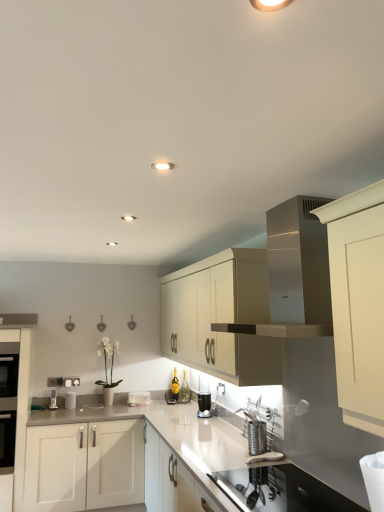
Question: From the image's perspective, is clear glass cup at center, the 3th appliance in the back-to-front sequence, positioned above or below white glossy toaster at center, which is the 2th appliance in left-to-right order?

Choices:
 (A) above
 (B) below

Answer: (A)

Question: From a real-world perspective, relative to white glossy toaster at center, the 3th appliance viewed from the front, is clear glass cup at center, the 3th appliance in the back-to-front sequence, vertically above or below?

Choices:
 (A) below
 (B) above

Answer: (B)

Question: Which object is positioned closest to the white glossy toaster at center, the second appliance in the right-to-left sequence?

Choices:
 (A) matte cream cabinet at center, the first cabinetry from the right
 (B) black glass oven at left
 (C) white glossy toaster at lower left, acting as the second appliance starting from the back
 (D) clear glass cup at center, which is the 1th appliance in right-to-left order
 (E) satin silver vent at upper center

Answer: (C)

Question: Estimate the real-world distances between objects in this image. Which object is closer to the clear glass cup at center, which is the 1th appliance in right-to-left order?

Choices:
 (A) white glossy countertop at center
 (B) satin silver vent at upper center
 (C) matte cream cabinet at center, the first cabinetry from the right
 (D) black glass oven at left
 (E) white glossy cabinet at left, arranged as the 1th cabinetry when viewed from the left

Answer: (A)